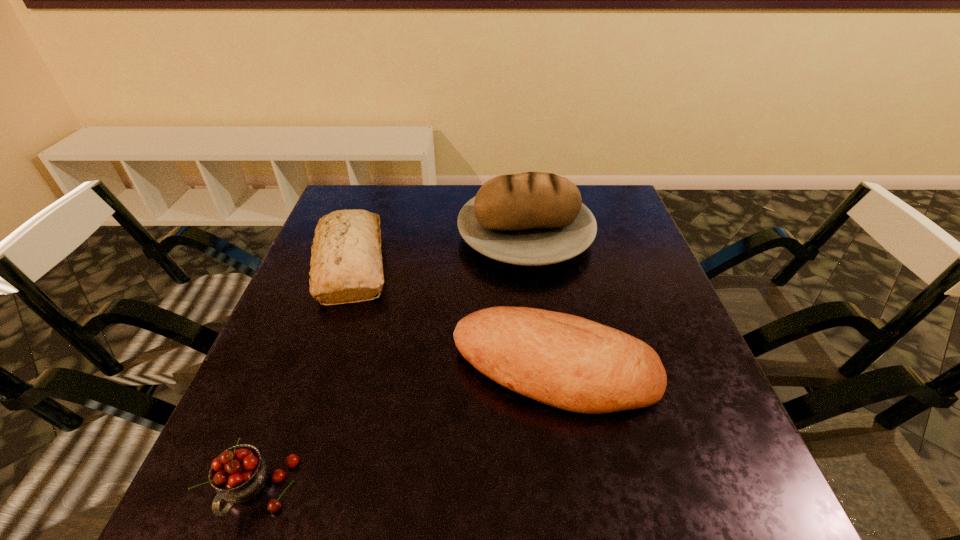
Image resolution: width=960 pixels, height=540 pixels. In order to click on the tallest bread in this screenshot , I will do `click(533, 218)`.

Where is `the leftmost bread`? The width and height of the screenshot is (960, 540). the leftmost bread is located at coordinates tap(346, 265).

Where is `the nearest bread`? the nearest bread is located at coordinates (566, 361).

Identify the location of cherry. This screenshot has height=540, width=960. (238, 474).

This screenshot has height=540, width=960. I want to click on free region located on the front of the tallest object, so click(x=537, y=318).

I want to click on vacant space located on the front of the leftmost bread, so click(x=307, y=392).

Find the location of `vacant space located 0.070m on the right of the third farthest object`. vacant space located 0.070m on the right of the third farthest object is located at coordinates (692, 369).

Find the location of a particular element. The image size is (960, 540). object that is positioned at the far edge is located at coordinates (533, 218).

At what (x,y) coordinates should I click in order to perform the action: click on object that is positioned at the near edge. Please return your answer as a coordinate pair (x, y). Looking at the image, I should click on (238, 474).

You are a GUI agent. You are given a task and a screenshot of the screen. Output one action in this format:
    pyautogui.click(x=<x>, y=<y>)
    Task: Click on the bread located at the left edge
    Image resolution: width=960 pixels, height=540 pixels.
    Given the screenshot: What is the action you would take?
    pyautogui.click(x=346, y=265)